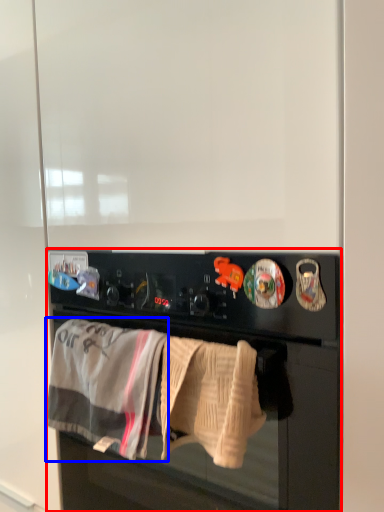
Question: Which object appears closest to the camera in this image, home appliance (highlighted by a red box) or bath towel (highlighted by a blue box)?

Choices:
 (A) home appliance
 (B) bath towel

Answer: (A)